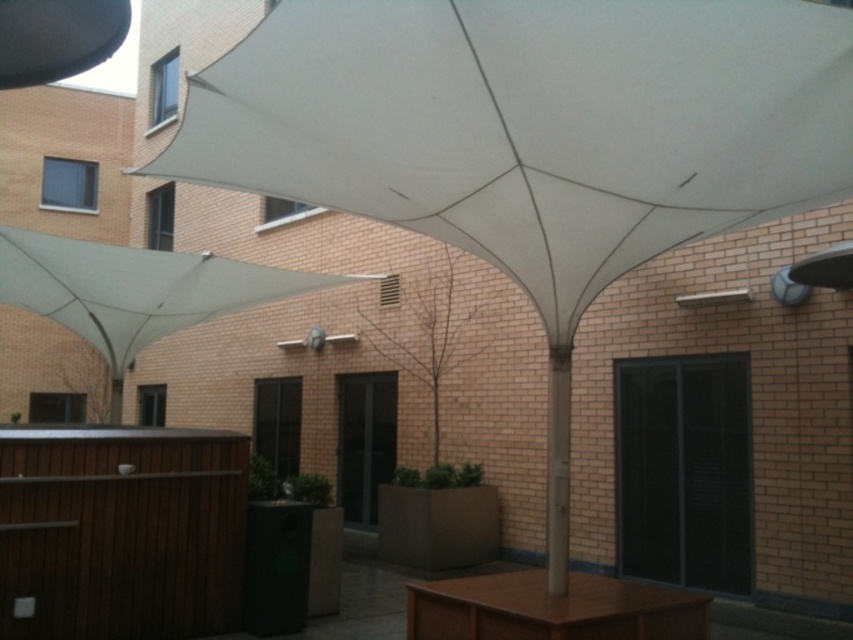
You are planning to place a new potted plant in the courtyard. The plant needs to be under the white fabric canopy at center to avoid direct sunlight. Where should you position the plant relative to the brown wooden table at center?

The white fabric canopy at center is above the brown wooden table at center, so placing the plant near the brown wooden table at center will ensure it stays under the canopy and out of direct sunlight.

You are standing in the courtyard and want to take a photo. You notice two points marked in the scene. Which point, point (645,129) or point (662,595), is closer to your camera position?

Point (645,129) is closer to the camera than point (662,595).

You are standing in the courtyard and want to take a photo of the white fabric canopy at center. If your camera can focus on objects up to 10 feet away, will you need to move closer or farther away to ensure the canopy is in focus?

The white fabric canopy at center is 8.61 feet away from the camera, which is within the camera focus range of up to 10 feet. Therefore, you do not need to move closer or farther away. The canopy is already within the focus range.